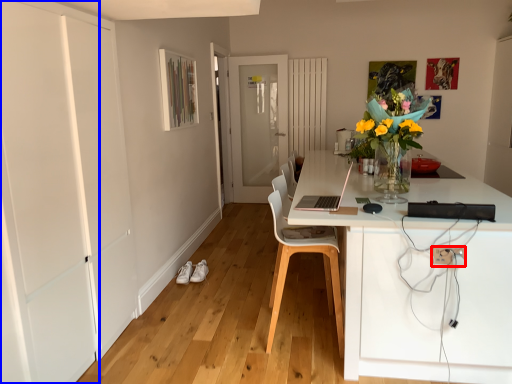
Question: Which of the following is the farthest to the observer, electric outlet (highlighted by a red box) or door (highlighted by a blue box)?

Choices:
 (A) electric outlet
 (B) door

Answer: (A)